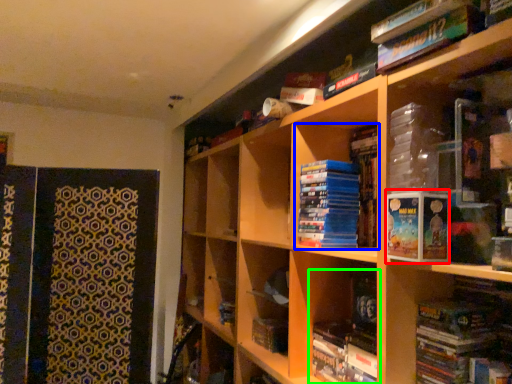
Question: Which object is the closest to the paperback book (highlighted by a red box)? Choose among these: book (highlighted by a blue box) or book (highlighted by a green box).

Choices:
 (A) book
 (B) book

Answer: (B)